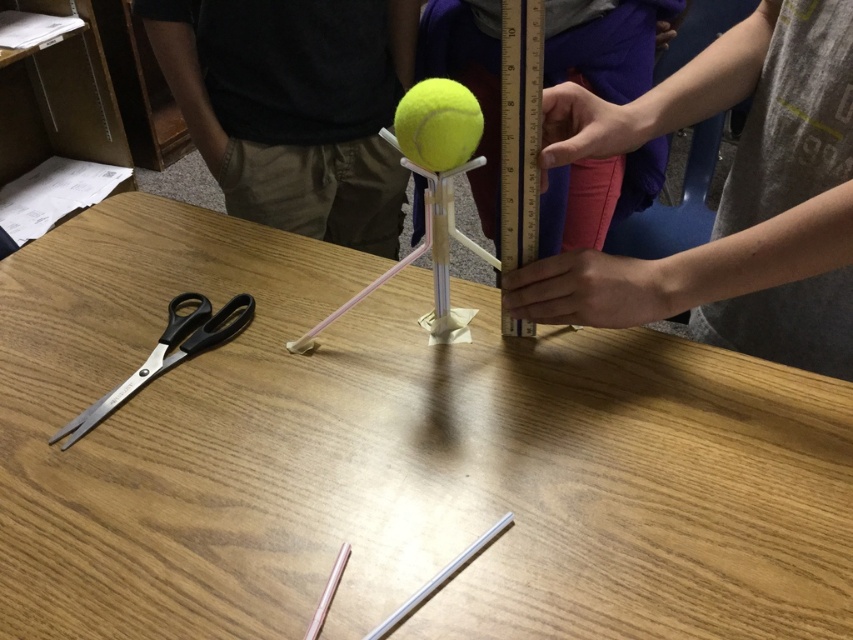
Is gray cotton shirt at upper right bigger than black plastic scissors at left?

Indeed, gray cotton shirt at upper right has a larger size compared to black plastic scissors at left.

Is gray cotton shirt at upper right shorter than black plastic scissors at left?

No.

Between point (727, 93) and point (113, 394), which one is positioned in front?

Point (113, 394) is more forward.

You are a GUI agent. You are given a task and a screenshot of the screen. Output one action in this format:
    pyautogui.click(x=<x>, y=<y>)
    Task: Click on the gray cotton shirt at upper right
    This screenshot has height=640, width=853.
    Given the screenshot: What is the action you would take?
    pyautogui.click(x=729, y=196)

How distant is wooden table at center from gray cotton shirt at upper right?

They are 9.08 inches apart.

From the picture: Between wooden table at center and gray cotton shirt at upper right, which one is positioned higher?

gray cotton shirt at upper right is higher up.

Who is more distant from viewer, (129, 358) or (780, 106)?

The point (129, 358) is behind.

The height and width of the screenshot is (640, 853). I want to click on wooden table at center, so click(x=392, y=458).

Does gray cotton shirt at upper right have a smaller size compared to yellow matte tennis ball at center?

No, gray cotton shirt at upper right is not smaller than yellow matte tennis ball at center.

From the picture: Which is more to the right, gray cotton shirt at upper right or yellow matte tennis ball at center?

Positioned to the right is gray cotton shirt at upper right.

Is point (680, 74) farther from viewer compared to point (434, 109)?

That is True.

I want to click on gray cotton shirt at upper right, so click(729, 196).